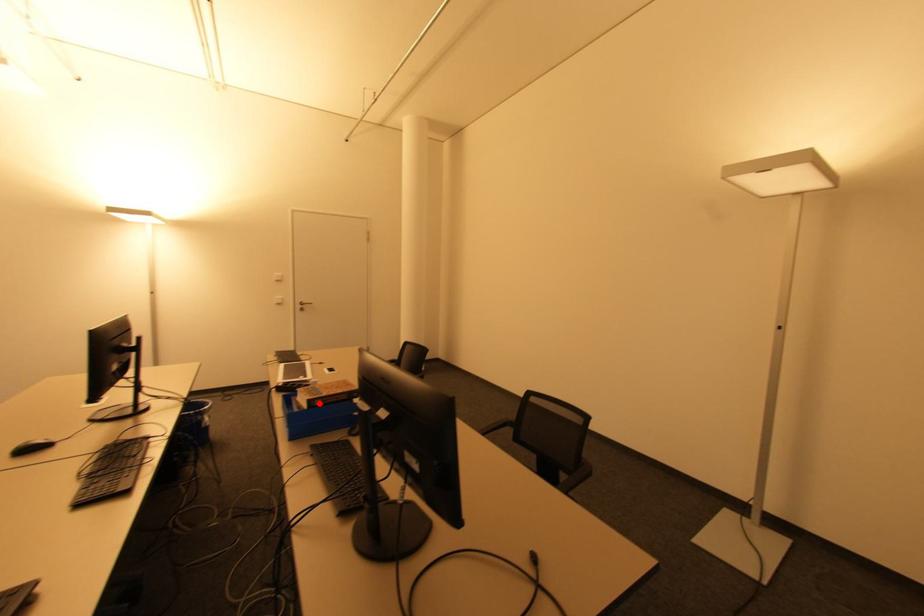
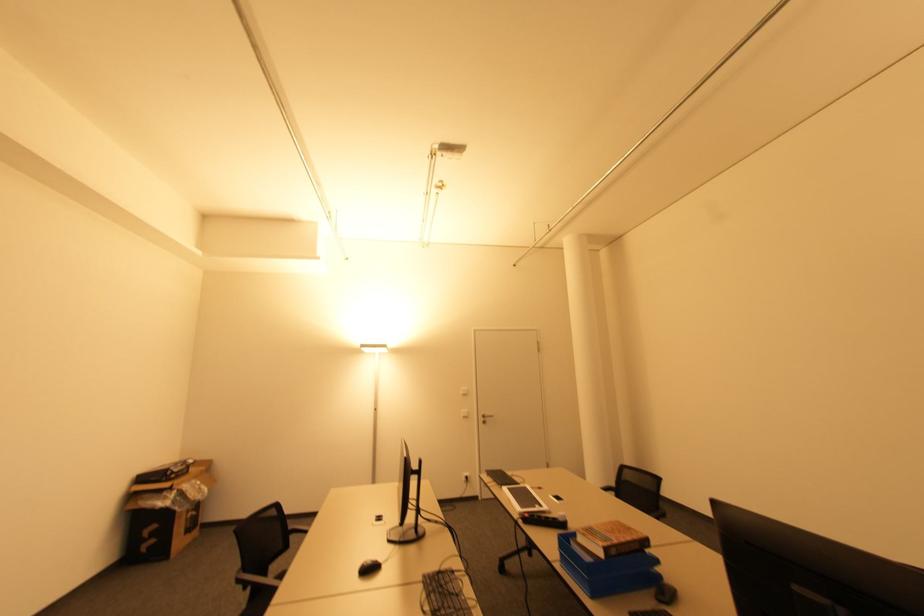
Locate, in the second image, the point that corresponds to the highlighted location in the first image.

(615, 553)